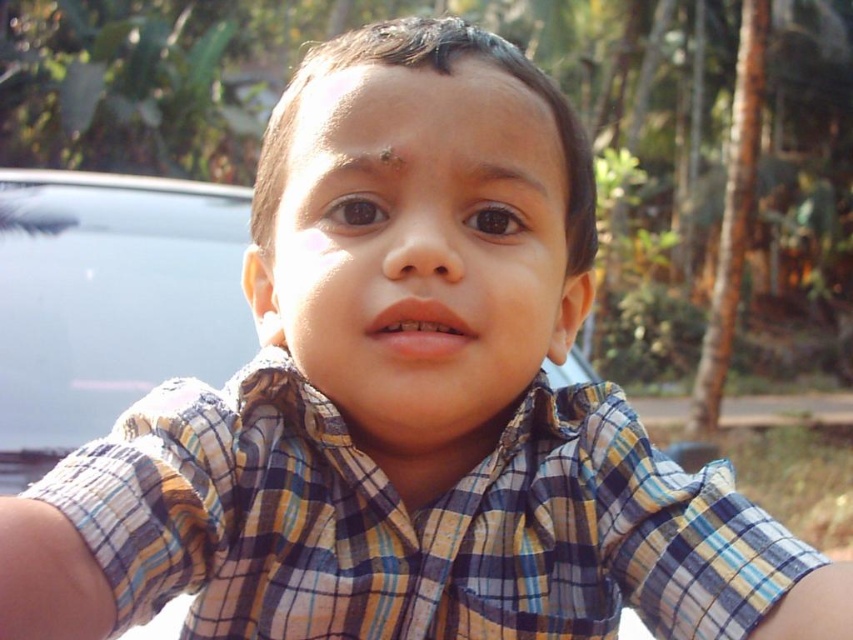
From the picture: Is plaid shirt at center shorter than metallic gray car at center?

Yes, plaid shirt at center is shorter than metallic gray car at center.

Is plaid shirt at center smaller than metallic gray car at center?

Correct, plaid shirt at center occupies less space than metallic gray car at center.

Find the location of a particular element. plaid shirt at center is located at coordinates (413, 524).

Find the location of `plaid shirt at center`. plaid shirt at center is located at coordinates (413, 524).